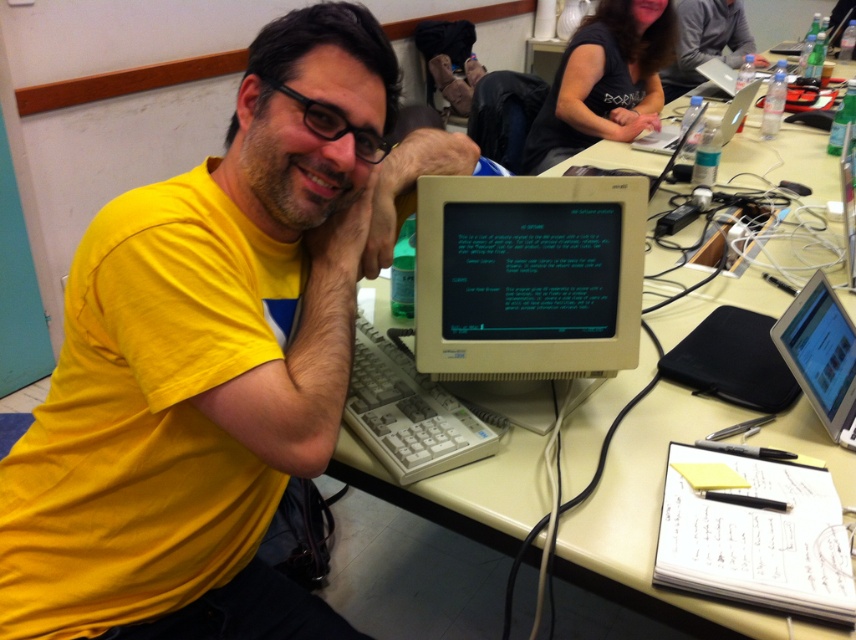
You are setting up a presentation and need to decide which device to use for displaying slides. Considering the white plastic monitor at center and the silver metallic laptop at right, which one has a larger screen height?

The white plastic monitor at center is much taller than the silver metallic laptop at right, so it has a larger screen height for displaying slides.

From the picture: You are organizing a tech event and need to place a large poster on the table. The poster requires a surface area larger than the white plastic monitor at center. Can the silver metallic laptop at right provide enough space for the poster?

The white plastic monitor at center is bigger than the silver metallic laptop at right, so the silver metallic laptop at right is smaller and cannot provide enough space for the poster that needs a surface area larger than the white plastic monitor at center.